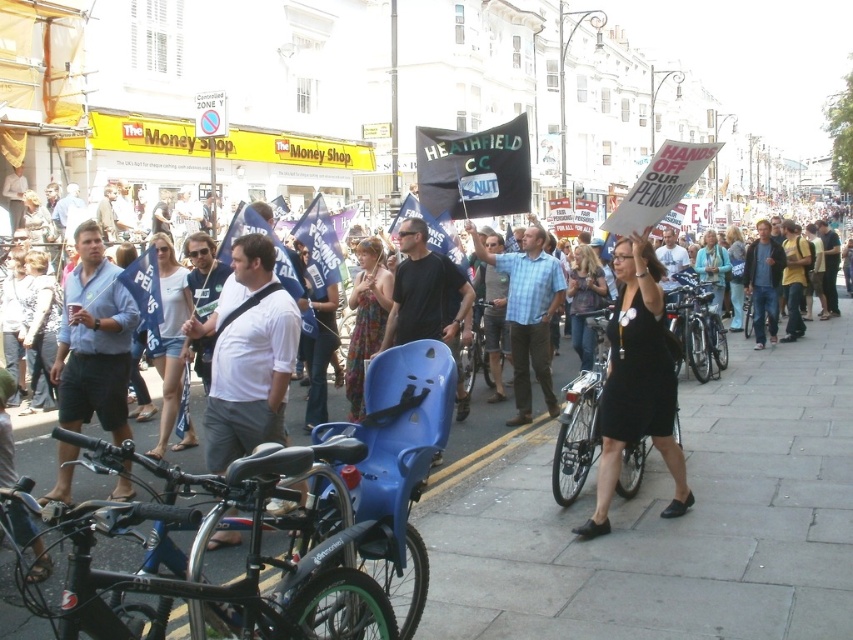
You are a photographer trying to capture a clear shot of the light blue shirt at center and the plaid fabric shirt at center. Which of the two shirts should you focus on first to ensure the foreground subject is sharp?

The light blue shirt at center is in front of the plaid fabric shirt at center, so you should focus on the light blue shirt at center first to ensure the foreground subject is sharp.